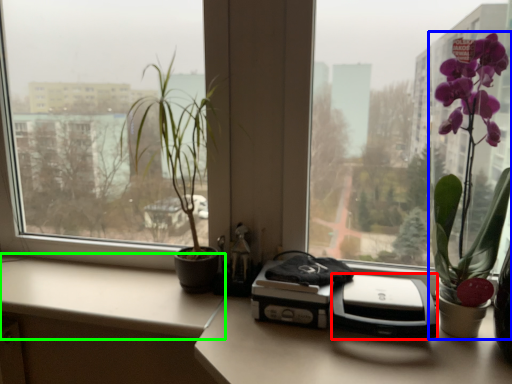
Question: Which object is positioned farthest from printer (highlighted by a red box)? Select from houseplant (highlighted by a blue box) and counter top (highlighted by a green box).

Choices:
 (A) houseplant
 (B) counter top

Answer: (B)